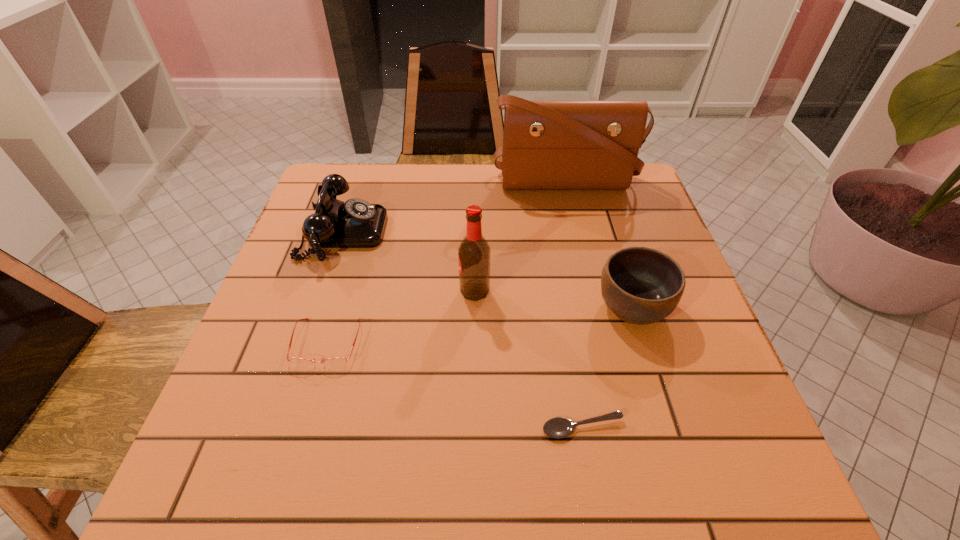
Where is `satchel that is at the right edge`? The height and width of the screenshot is (540, 960). satchel that is at the right edge is located at coordinates (547, 144).

What are the coordinates of `bowl present at the right edge` in the screenshot? It's located at (640, 285).

The height and width of the screenshot is (540, 960). In order to click on object present at the far left corner in this screenshot , I will do `click(356, 223)`.

Locate an element on the screen. object that is positioned at the far right corner is located at coordinates (547, 144).

Where is `free region at the far edge of the desktop`? The height and width of the screenshot is (540, 960). free region at the far edge of the desktop is located at coordinates (501, 185).

In the image, there is a desktop. Find the location of `free space at the near edge`. free space at the near edge is located at coordinates (327, 455).

What are the coordinates of `free point at the left edge` in the screenshot? It's located at (275, 388).

Find the location of a particular element. free region at the right edge is located at coordinates click(657, 238).

Locate an element on the screen. vacant region at the far left corner of the desktop is located at coordinates (345, 176).

Identify the location of vacant space at the far right corner. (614, 194).